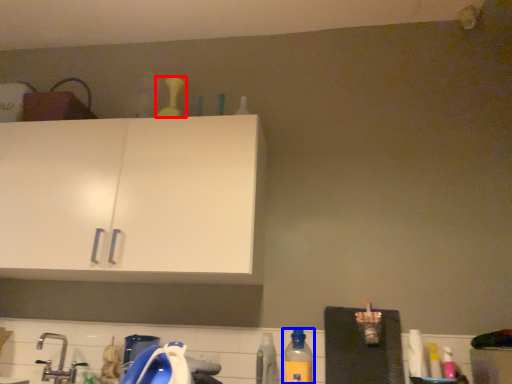
Question: Which object is closer to the camera taking this photo, bottle (highlighted by a red box) or bottle (highlighted by a blue box)?

Choices:
 (A) bottle
 (B) bottle

Answer: (B)